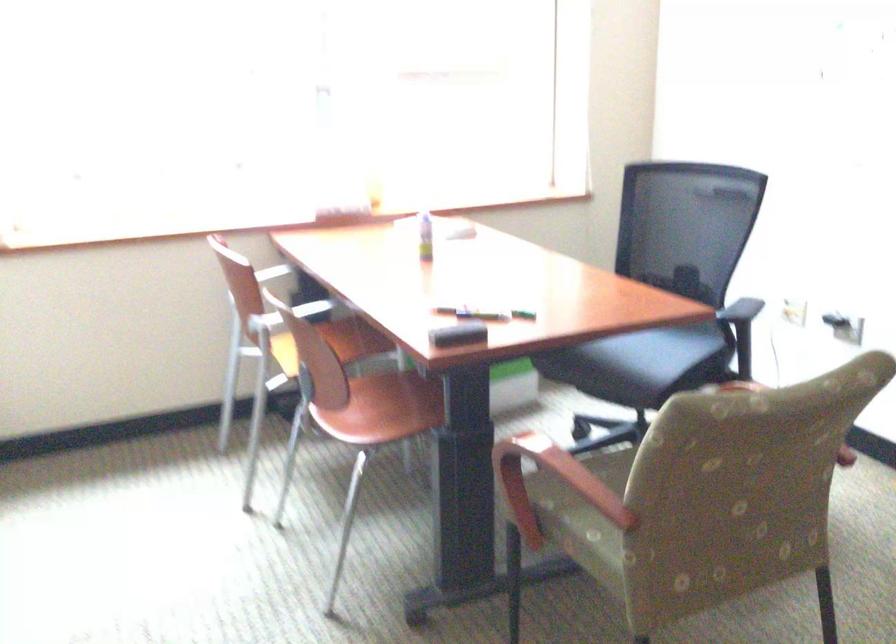
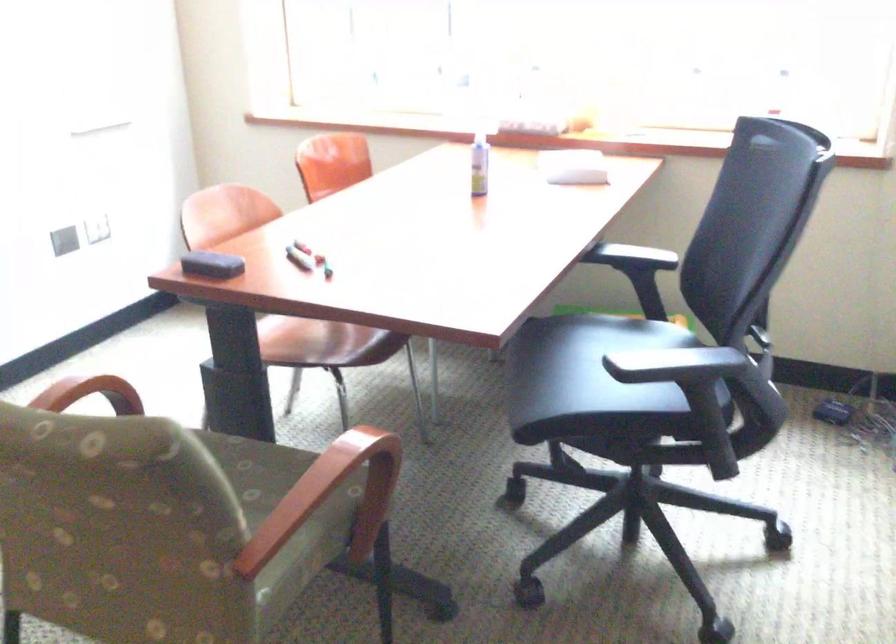
In the second image, find the point that corresponds to (x=452, y=333) in the first image.

(211, 265)